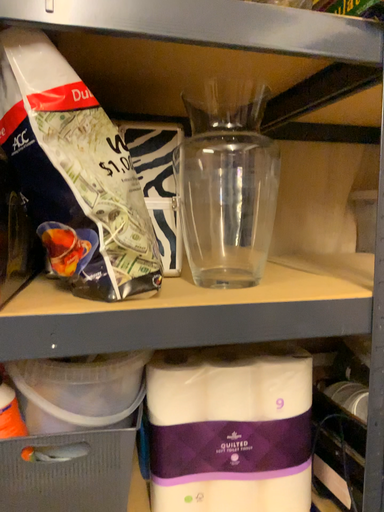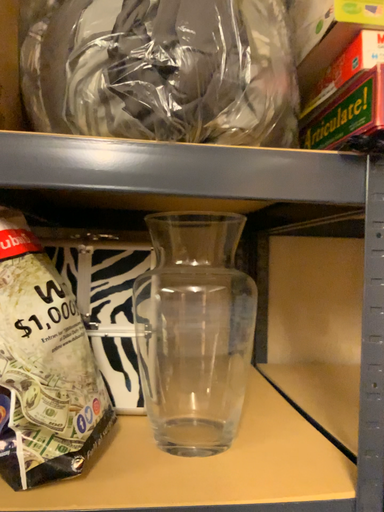
Question: How did the camera likely rotate when shooting the video?

Choices:
 (A) rotated upward
 (B) rotated downward

Answer: (A)